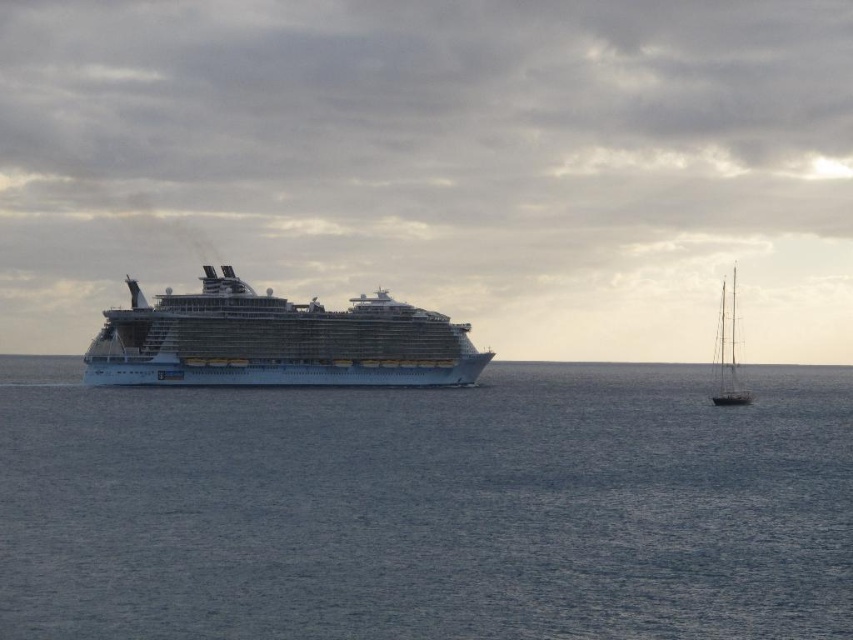
Question: Which of the following is the closest to the observer?

Choices:
 (A) blue water at center
 (B) white glossy cruise ship at center
 (C) wooden sailboat at right

Answer: (A)

Question: Which object appears farthest from the camera in this image?

Choices:
 (A) wooden sailboat at right
 (B) blue water at center

Answer: (A)

Question: Can you confirm if white glossy cruise ship at center is positioned below wooden sailboat at right?

Choices:
 (A) no
 (B) yes

Answer: (A)

Question: Is blue water at center thinner than wooden sailboat at right?

Choices:
 (A) yes
 (B) no

Answer: (B)

Question: Is blue water at center thinner than wooden sailboat at right?

Choices:
 (A) yes
 (B) no

Answer: (B)

Question: Among these objects, which one is farthest from the camera?

Choices:
 (A) white glossy cruise ship at center
 (B) wooden sailboat at right
 (C) blue water at center

Answer: (B)